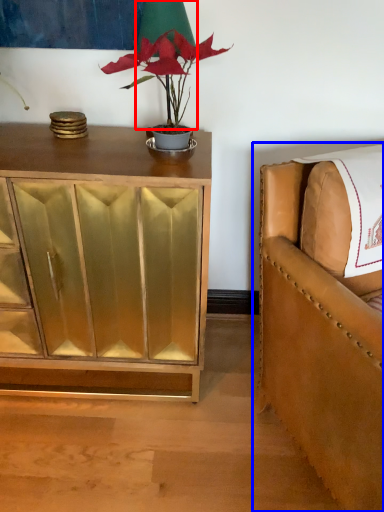
Question: Which object is closer to the camera taking this photo, table lamp (highlighted by a red box) or chair (highlighted by a blue box)?

Choices:
 (A) table lamp
 (B) chair

Answer: (B)